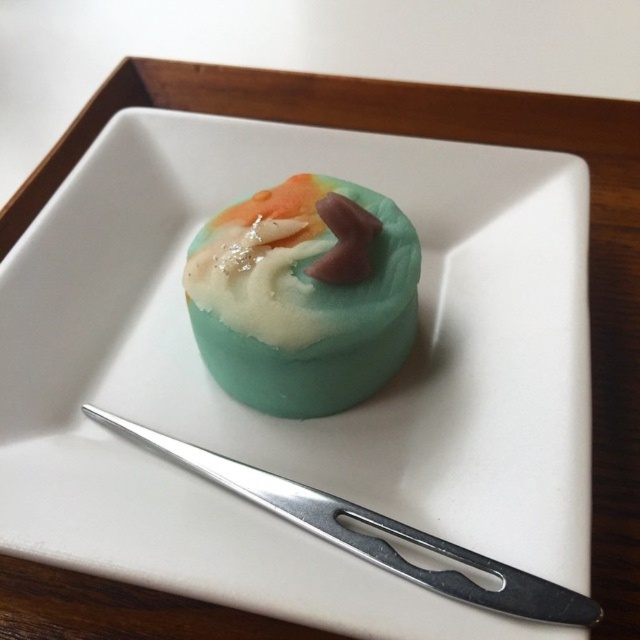
Question: Does silver metallic knife at center appear over semi-sweet chocolate frosting at center?

Choices:
 (A) no
 (B) yes

Answer: (A)

Question: Based on their relative distances, which object is nearer to the silver metallic knife at center?

Choices:
 (A) semi-sweet chocolate frosting at center
 (B) matte teal cake at center

Answer: (B)

Question: Which of the following is the farthest from the observer?

Choices:
 (A) (216, 236)
 (B) (396, 260)
 (C) (268, 486)

Answer: (A)

Question: Which point is farther to the camera?

Choices:
 (A) semi-sweet chocolate frosting at center
 (B) matte teal cake at center

Answer: (A)

Question: Does matte teal cake at center have a greater width compared to semi-sweet chocolate frosting at center?

Choices:
 (A) yes
 (B) no

Answer: (A)

Question: Does matte teal cake at center appear under silver metallic knife at center?

Choices:
 (A) no
 (B) yes

Answer: (A)